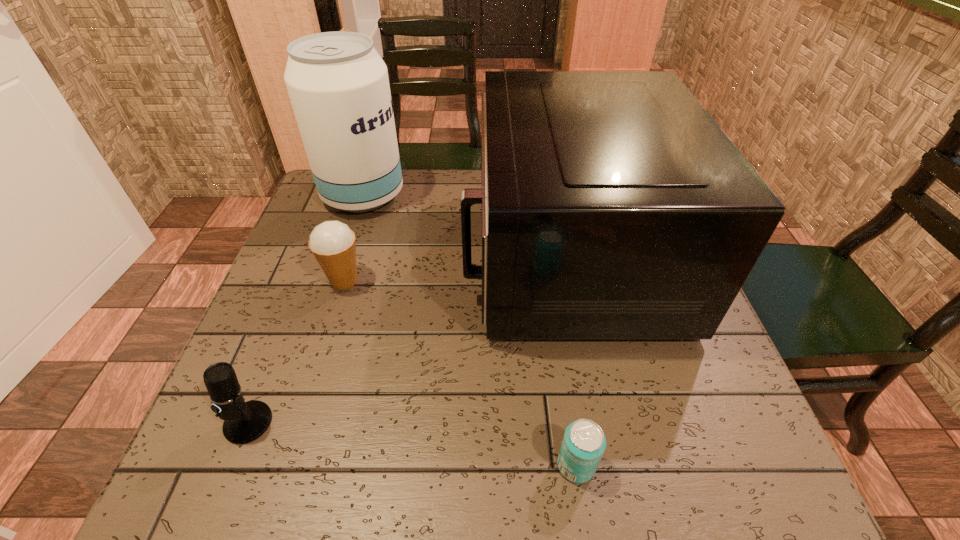
The height and width of the screenshot is (540, 960). Identify the location of object located in the right edge section of the desktop. (613, 206).

This screenshot has height=540, width=960. In order to click on object located in the far left corner section of the desktop in this screenshot , I will do `click(338, 84)`.

Where is `object that is at the near left corner`? The width and height of the screenshot is (960, 540). object that is at the near left corner is located at coordinates (244, 422).

The image size is (960, 540). I want to click on object that is positioned at the far right corner, so click(613, 206).

Locate an element on the screen. blank area at the far edge is located at coordinates (435, 171).

Where is `vacant space at the near edge of the desktop`? This screenshot has width=960, height=540. vacant space at the near edge of the desktop is located at coordinates (486, 488).

This screenshot has width=960, height=540. I want to click on blank space at the left edge, so click(363, 231).

Find the location of a particular element. vacant area at the right edge is located at coordinates (748, 434).

Image resolution: width=960 pixels, height=540 pixels. In the image, there is a desktop. Identify the location of blank space at the far left corner. (326, 207).

The image size is (960, 540). Find the location of `unoccupied area between the beer can and the fourth farthest object`. unoccupied area between the beer can and the fourth farthest object is located at coordinates (412, 444).